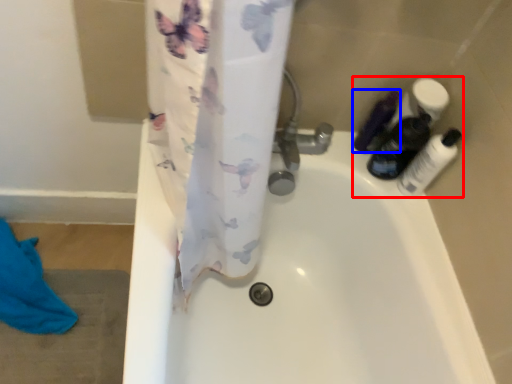
Question: Among these objects, which one is nearest to the camera, toiletry (highlighted by a red box) or toiletry (highlighted by a blue box)?

Choices:
 (A) toiletry
 (B) toiletry

Answer: (A)